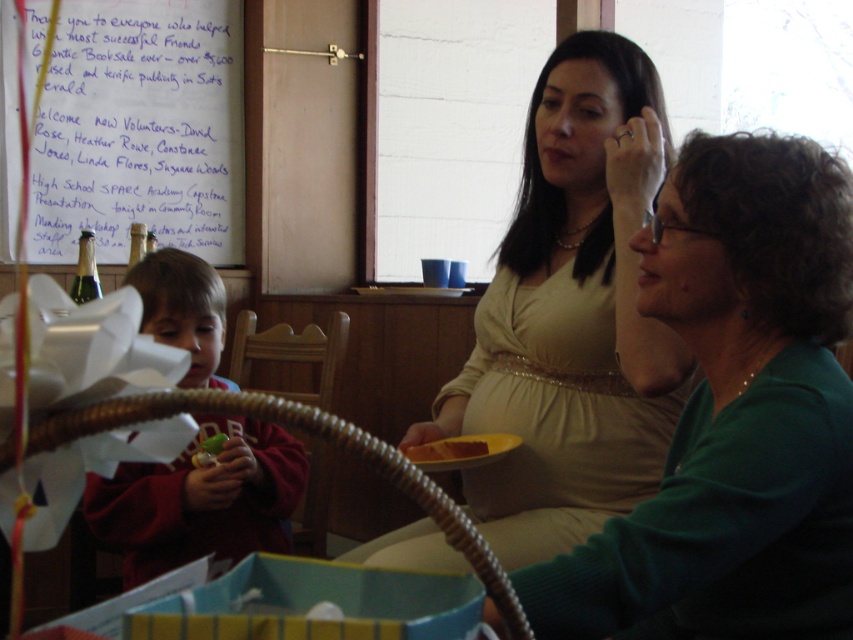
You are standing at the center of the image and see a point marked at coordinates (735, 413). Which object is this point located on?

The point at coordinates (735, 413) is located on the green matte sweater at center.

You are a photographer trying to capture a candid shot of the matte green sweater at center and the yellow cake at center. Since you want to ensure both are in focus, you need to know which object is wider. Which one is wider?

The matte green sweater at center is wider than the yellow cake at center according to the description.

Where is the matte green sweater at center located in the image?

The matte green sweater at center is located at point (572, 316) in the image.